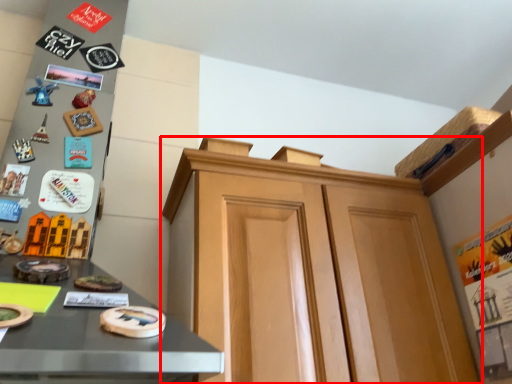
Question: From the image's perspective, what is the correct spatial positioning of cabinetry (annotated by the red box) in reference to toy?

Choices:
 (A) below
 (B) above

Answer: (A)